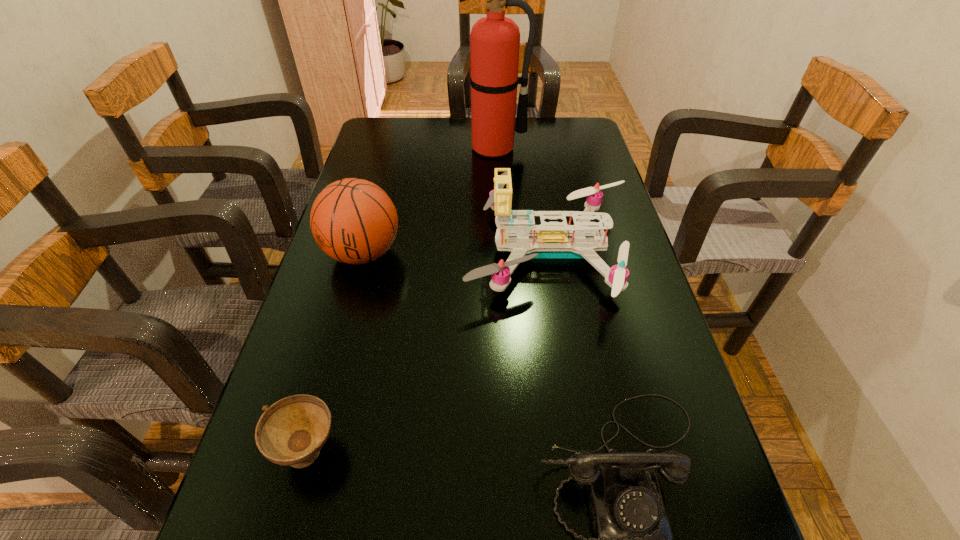
Image resolution: width=960 pixels, height=540 pixels. Identify the location of fire extinguisher. (494, 40).

Locate an element on the screen. The height and width of the screenshot is (540, 960). the farthest object is located at coordinates (494, 40).

Locate an element on the screen. This screenshot has height=540, width=960. drone is located at coordinates (549, 239).

Locate an element on the screen. This screenshot has width=960, height=540. basketball is located at coordinates (354, 221).

Where is `soup bowl`? This screenshot has height=540, width=960. soup bowl is located at coordinates (292, 431).

Find the location of a particular element. blank space located 0.380m at the nozzle of the tallest object is located at coordinates (498, 238).

Locate an element on the screen. vacant space situated on the front-facing side of the drone is located at coordinates (338, 252).

Identify the location of vacant space located on the front-facing side of the drone. Image resolution: width=960 pixels, height=540 pixels. (434, 252).

I want to click on free space located on the front-facing side of the drone, so click(x=350, y=252).

Find the location of a particular element. Image resolution: width=960 pixels, height=540 pixels. vacant space situated on the right of the basketball is located at coordinates (467, 253).